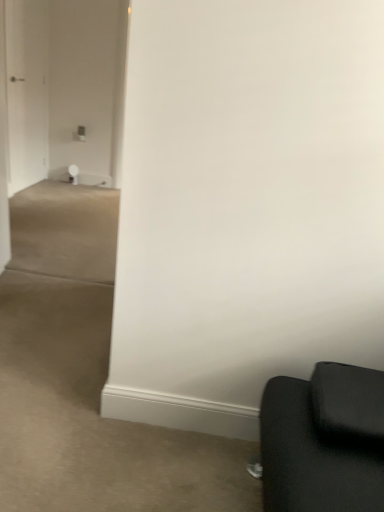
The height and width of the screenshot is (512, 384). Describe the element at coordinates (4, 150) in the screenshot. I see `white glossy door at left` at that location.

Where is `white glossy door at left`? white glossy door at left is located at coordinates (4, 150).

Describe the element at coordinates (27, 92) in the screenshot. This screenshot has width=384, height=512. I see `white glossy door at upper left` at that location.

Where is `white glossy door at upper left`? This screenshot has width=384, height=512. white glossy door at upper left is located at coordinates (27, 92).

Locate an element on the screen. The width and height of the screenshot is (384, 512). white glossy door at left is located at coordinates (4, 150).

Is white glossy door at left at the right side of white glossy door at upper left?

Correct, you'll find white glossy door at left to the right of white glossy door at upper left.

Is white glossy door at left further to the viewer compared to white glossy door at upper left?

No, it is in front of white glossy door at upper left.

Does point (4, 163) come in front of point (43, 168)?

Yes, it is.

From the image's perspective, would you say white glossy door at left is shown under white glossy door at upper left?

Yes, from the image's perspective, white glossy door at left is beneath white glossy door at upper left.

From a real-world perspective, relative to white glossy door at upper left, is white glossy door at left vertically above or below?

From a real-world perspective, white glossy door at left is physically below white glossy door at upper left.

Considering the sizes of objects white glossy door at left and white glossy door at upper left in the image provided, who is thinner, white glossy door at left or white glossy door at upper left?

white glossy door at upper left.

Which of these two, white glossy door at left or white glossy door at upper left, stands taller?

With more height is white glossy door at upper left.

Considering the relative sizes of white glossy door at left and white glossy door at upper left in the image provided, is white glossy door at left smaller than white glossy door at upper left?

Yes, white glossy door at left is smaller than white glossy door at upper left.

Which is correct: white glossy door at left is inside white glossy door at upper left, or outside of it?

white glossy door at left lies outside white glossy door at upper left.

Based on the photo, is white glossy door at left not close to white glossy door at upper left?

No.

Could you tell me if white glossy door at left is facing white glossy door at upper left?

No, white glossy door at left is not oriented towards white glossy door at upper left.

Where is `door located in front of the white glossy door at upper left`? Image resolution: width=384 pixels, height=512 pixels. door located in front of the white glossy door at upper left is located at coordinates (4, 150).

Does white glossy door at upper left appear on the left side of white glossy door at left?

Yes.

Is white glossy door at upper left behind white glossy door at left?

Yes, the depth of white glossy door at upper left is greater than that of white glossy door at left.

Considering the points (27, 166) and (0, 124), which point is in front, point (27, 166) or point (0, 124)?

Point (0, 124)

From the image's perspective, is white glossy door at upper left above or below white glossy door at left?

From the image's perspective, white glossy door at upper left appears above white glossy door at left.

From a real-world perspective, which is physically below, white glossy door at upper left or white glossy door at left?

white glossy door at left is physically lower.

Which of these two, white glossy door at upper left or white glossy door at left, is wider?

With larger width is white glossy door at left.

Who is taller, white glossy door at upper left or white glossy door at left?

Standing taller between the two is white glossy door at upper left.

Is white glossy door at upper left bigger or smaller than white glossy door at left?

In the image, white glossy door at upper left appears to be larger than white glossy door at left.

Is white glossy door at upper left located outside white glossy door at left?

white glossy door at upper left is positioned outside white glossy door at left.

Are white glossy door at upper left and white glossy door at left located far from each other?

That's not correct — white glossy door at upper left is a little close to white glossy door at left.

Is white glossy door at upper left positioned with its back to white glossy door at left?

white glossy door at upper left does not have its back to white glossy door at left.

How different are the orientations of white glossy door at upper left and white glossy door at left in degrees?

The angular difference between white glossy door at upper left and white glossy door at left is 11.4 degrees.

There is a white glossy door at left. What are the coordinates of `glass door above it (from a real-world perspective)` in the screenshot? It's located at (27, 92).

In the image, there is a white glossy door at left. Where is `glass door above it (from the image's perspective)`? This screenshot has width=384, height=512. glass door above it (from the image's perspective) is located at coordinates (27, 92).

Identify the location of glass door above the white glossy door at left (from a real-world perspective). (27, 92).